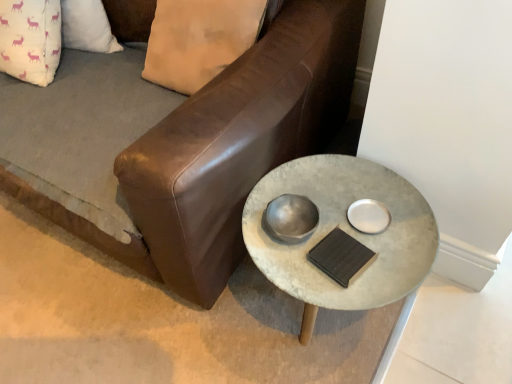
Locate an element on the screen. This screenshot has width=512, height=384. brown leather couch at center is located at coordinates (225, 149).

Image resolution: width=512 pixels, height=384 pixels. Describe the element at coordinates (225, 149) in the screenshot. I see `brown leather couch at center` at that location.

Measure the distance between concrete textured table at center and camera.

They are 32.90 inches apart.

This screenshot has height=384, width=512. Describe the element at coordinates (345, 232) in the screenshot. I see `concrete textured table at center` at that location.

Measure the distance between point (253,243) and camera.

The distance of point (253,243) from camera is 37.09 inches.

Identify the location of concrete textured table at center. (345, 232).

Locate an element on the screen. The height and width of the screenshot is (384, 512). brown leather couch at center is located at coordinates (225, 149).

Which is more to the right, concrete textured table at center or brown leather couch at center?

concrete textured table at center.

Is concrete textured table at center positioned before brown leather couch at center?

No.

Does point (383, 202) lie in front of point (224, 281)?

Yes, point (383, 202) is in front of point (224, 281).

From the image's perspective, would you say concrete textured table at center is shown under brown leather couch at center?

Yes, from the image's perspective, concrete textured table at center is beneath brown leather couch at center.

From a real-world perspective, which object stands above the other?

In real-world perspective, concrete textured table at center is above.

Considering the sizes of objects concrete textured table at center and brown leather couch at center in the image provided, who is wider, concrete textured table at center or brown leather couch at center?

brown leather couch at center is wider.

In the scene shown: Can you confirm if concrete textured table at center is taller than brown leather couch at center?

Yes, concrete textured table at center is taller than brown leather couch at center.

Does concrete textured table at center have a larger size compared to brown leather couch at center?

Incorrect, concrete textured table at center is not larger than brown leather couch at center.

Is concrete textured table at center not inside brown leather couch at center?

Absolutely, concrete textured table at center is external to brown leather couch at center.

Would you consider concrete textured table at center to be distant from brown leather couch at center?

concrete textured table at center is near brown leather couch at center, not far away.

Is concrete textured table at center facing away from brown leather couch at center?

No, concrete textured table at center is not facing away from brown leather couch at center.

How distant is concrete textured table at center from brown leather couch at center?

concrete textured table at center is 9.17 inches away from brown leather couch at center.

At what (x,y) coordinates should I click in order to perform the action: click on studio couch on the left of concrete textured table at center. Please return your answer as a coordinate pair (x, y). Image resolution: width=512 pixels, height=384 pixels. Looking at the image, I should click on (225, 149).

Which is more to the right, brown leather couch at center or concrete textured table at center?

From the viewer's perspective, concrete textured table at center appears more on the right side.

Is the depth of brown leather couch at center greater than that of concrete textured table at center?

No, brown leather couch at center is in front of concrete textured table at center.

Does point (213, 212) appear closer or farther from the camera than point (386, 196)?

Clearly, point (213, 212) is closer to the camera than point (386, 196).

From the image's perspective, is brown leather couch at center positioned above or below concrete textured table at center?

brown leather couch at center is above concrete textured table at center.

Consider the image. From a real-world perspective, between brown leather couch at center and concrete textured table at center, who is vertically lower?

brown leather couch at center is physically lower.

Looking at this image, which object is thinner, brown leather couch at center or concrete textured table at center?

Thinner between the two is concrete textured table at center.

From their relative heights in the image, would you say brown leather couch at center is taller or shorter than concrete textured table at center?

Considering their sizes, brown leather couch at center has less height than concrete textured table at center.

Can you confirm if brown leather couch at center is smaller than concrete textured table at center?

Incorrect, brown leather couch at center is not smaller in size than concrete textured table at center.

Is concrete textured table at center a part of brown leather couch at center?

Actually, concrete textured table at center is outside brown leather couch at center.

Is brown leather couch at center not close to concrete textured table at center?

No, there isn't a large distance between brown leather couch at center and concrete textured table at center.

From the picture: Could you tell me if brown leather couch at center is facing concrete textured table at center?

Yes, brown leather couch at center is oriented towards concrete textured table at center.

How distant is brown leather couch at center from concrete textured table at center?

brown leather couch at center is 9.17 inches away from concrete textured table at center.

This screenshot has height=384, width=512. In order to click on studio couch above the concrete textured table at center (from the image's perspective) in this screenshot , I will do `click(225, 149)`.

Where is `studio couch on the left of concrete textured table at center`? The height and width of the screenshot is (384, 512). studio couch on the left of concrete textured table at center is located at coordinates (225, 149).

At what (x,y) coordinates should I click in order to perform the action: click on table behind the brown leather couch at center. Please return your answer as a coordinate pair (x, y). This screenshot has width=512, height=384. Looking at the image, I should click on (345, 232).